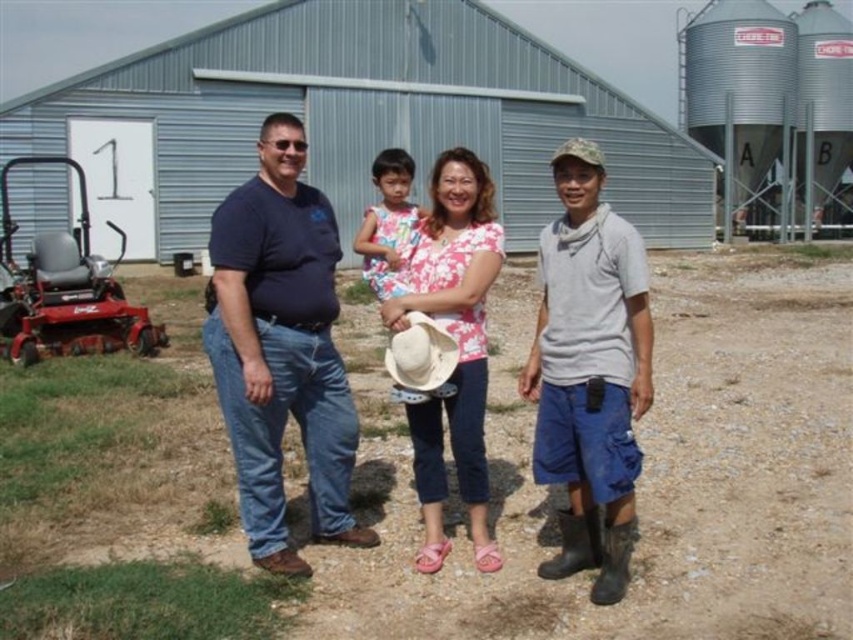
Question: Which object appears farthest from the camera in this image?

Choices:
 (A) floral fabric dress at center
 (B) dark blue t-shirt at center
 (C) dirt at center

Answer: (A)

Question: Which point appears farthest from the camera in this image?

Choices:
 (A) (631, 497)
 (B) (593, 225)

Answer: (A)

Question: Where is gray cotton shirt at center located in relation to white matte cowboy hat at center in the image?

Choices:
 (A) right
 (B) left

Answer: (A)

Question: Does gray cotton shirt at center appear on the left side of white matte cowboy hat at center?

Choices:
 (A) no
 (B) yes

Answer: (A)

Question: Is gray cotton shirt at center positioned before white matte cowboy hat at center?

Choices:
 (A) yes
 (B) no

Answer: (A)

Question: Among these points, which one is farthest from the camera?

Choices:
 (A) (544, 324)
 (B) (698, 424)
 (C) (479, 292)

Answer: (B)